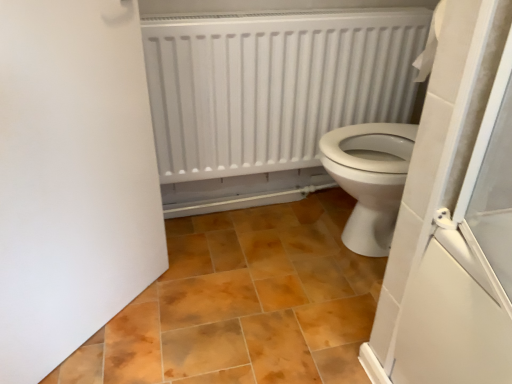
Question: Does brown matte tile at center touch white matte door at left?

Choices:
 (A) yes
 (B) no

Answer: (B)

Question: From a real-world perspective, is brown matte tile at center under white matte door at left?

Choices:
 (A) yes
 (B) no

Answer: (A)

Question: Is brown matte tile at center outside white matte door at left?

Choices:
 (A) no
 (B) yes

Answer: (B)

Question: Is brown matte tile at center facing towards white matte door at left?

Choices:
 (A) yes
 (B) no

Answer: (A)

Question: Considering the relative positions of brown matte tile at center and white matte door at left in the image provided, is brown matte tile at center in front of white matte door at left?

Choices:
 (A) no
 (B) yes

Answer: (A)

Question: From a real-world perspective, relative to brown matte tile at center, is white matte door at left vertically above or below?

Choices:
 (A) above
 (B) below

Answer: (A)

Question: Does point (65, 276) appear closer or farther from the camera than point (161, 291)?

Choices:
 (A) farther
 (B) closer

Answer: (B)

Question: In the image, is white matte door at left on the left side or the right side of brown matte tile at center?

Choices:
 (A) left
 (B) right

Answer: (A)

Question: Considering the positions of white matte door at left and brown matte tile at center in the image, is white matte door at left wider or thinner than brown matte tile at center?

Choices:
 (A) thin
 (B) wide

Answer: (A)

Question: In terms of height, does brown matte tile at center look taller or shorter compared to white matte radiator at upper center?

Choices:
 (A) short
 (B) tall

Answer: (A)

Question: From a real-world perspective, relative to white matte radiator at upper center, is brown matte tile at center vertically above or below?

Choices:
 (A) above
 (B) below

Answer: (B)

Question: Is brown matte tile at center spatially inside white matte radiator at upper center, or outside of it?

Choices:
 (A) outside
 (B) inside

Answer: (A)

Question: Looking at the image, does brown matte tile at center seem bigger or smaller compared to white matte radiator at upper center?

Choices:
 (A) small
 (B) big

Answer: (B)

Question: Is point (194, 142) closer or farther from the camera than point (110, 150)?

Choices:
 (A) closer
 (B) farther

Answer: (B)

Question: From a real-world perspective, is white matte radiator at upper center above or below white matte door at left?

Choices:
 (A) above
 (B) below

Answer: (A)